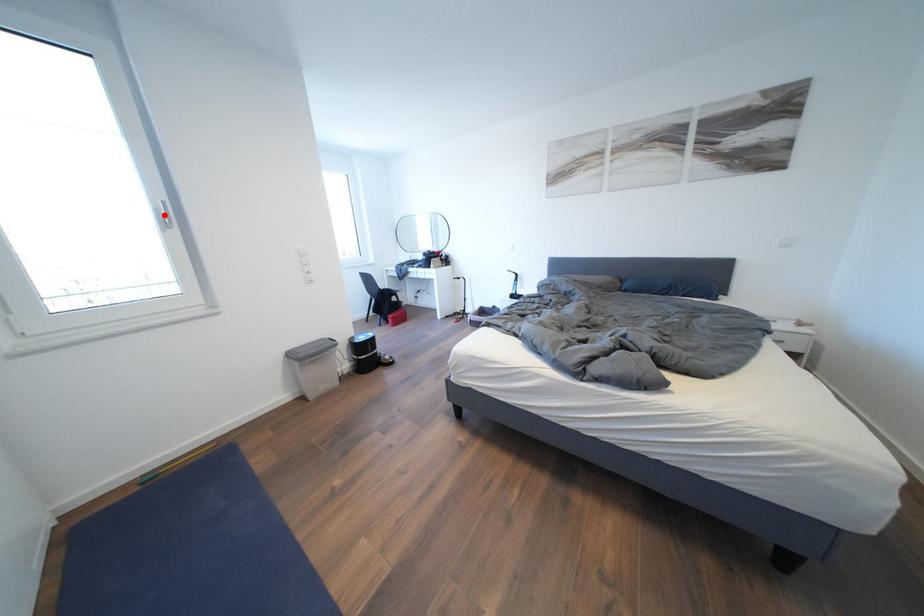
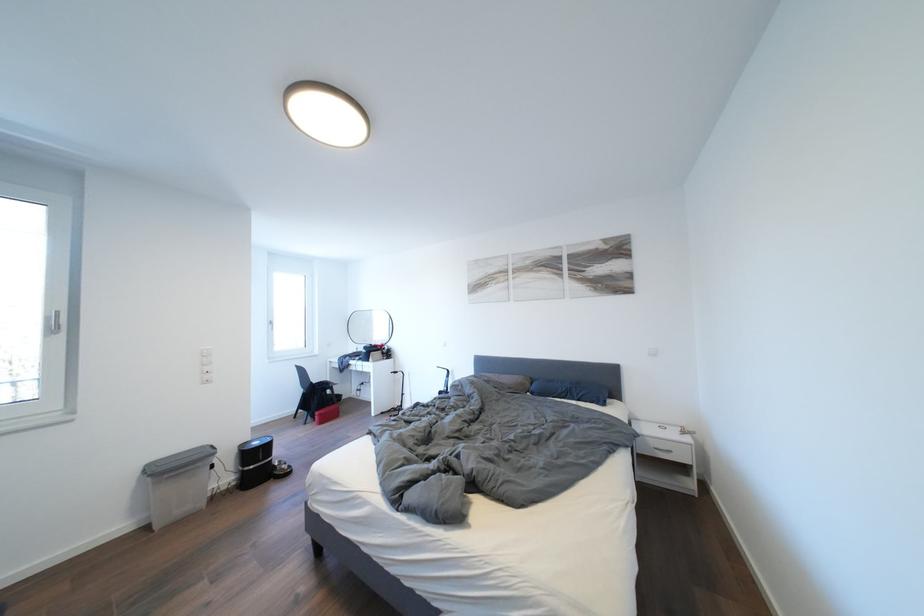
Question: A red point is marked in image1. In image2, is the corresponding 3D point closer to the camera or farther? Reply with the corresponding letter.

Choices:
 (A) The corresponding 3D point is closer.
 (B) The corresponding 3D point is farther.

Answer: (A)